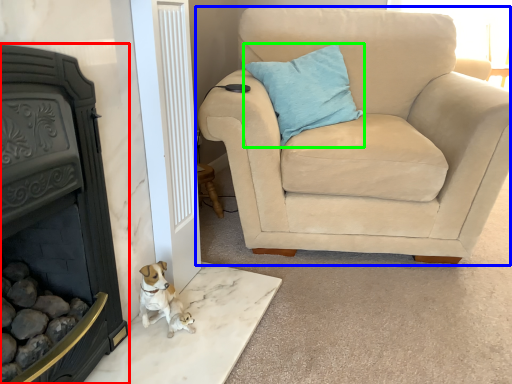
Question: Which object is the farthest from fireplace (highlighted by a red box)? Choose among these: chair (highlighted by a blue box) or pillow (highlighted by a green box).

Choices:
 (A) chair
 (B) pillow

Answer: (B)